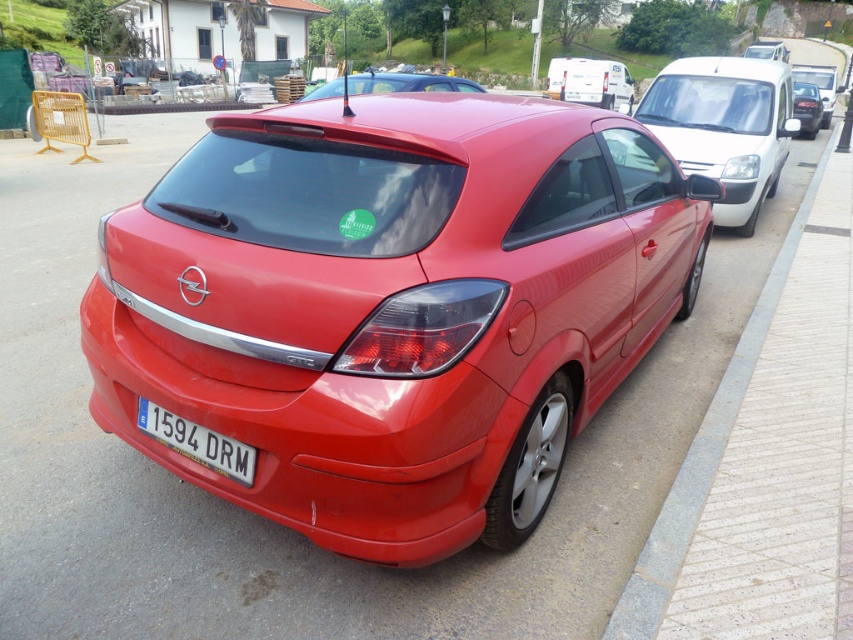
Can you confirm if white glossy van at upper right is positioned below gray concrete curb at lower right?

No.

Measure the distance between point (659, 125) and camera.

Point (659, 125) and camera are 8.36 meters apart.

Image resolution: width=853 pixels, height=640 pixels. Describe the element at coordinates (724, 125) in the screenshot. I see `white glossy van at upper right` at that location.

Find the location of a particular element. This screenshot has width=853, height=640. white glossy van at upper right is located at coordinates (724, 125).

Is glossy red car at center positioned in front of shiny black sedan at center?

Yes.

Between glossy red car at center and shiny black sedan at center, which one is positioned lower?

Positioned lower is shiny black sedan at center.

Does point (457, 84) lie behind point (813, 88)?

No, (457, 84) is in front of (813, 88).

At what (x,y) coordinates should I click in order to perform the action: click on glossy red car at center. Please return your answer as a coordinate pair (x, y). Image resolution: width=853 pixels, height=640 pixels. Looking at the image, I should click on (408, 83).

Is white glossy van at upper right closer to the viewer compared to shiny black sedan at center?

Yes, white glossy van at upper right is closer to the viewer.

The width and height of the screenshot is (853, 640). I want to click on white glossy van at upper right, so click(724, 125).

The height and width of the screenshot is (640, 853). In order to click on white glossy van at upper right in this screenshot , I will do `click(724, 125)`.